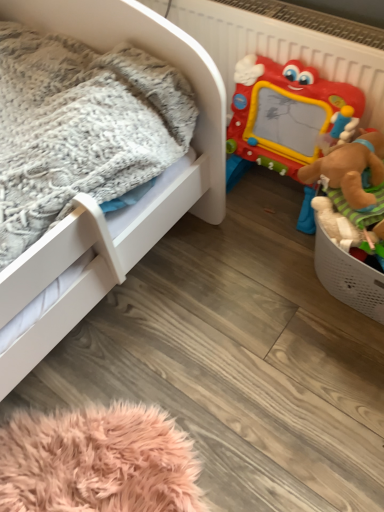
In order to click on vacant area situated below plastic drawing board at right (from a real-world perspective) in this screenshot , I will do `click(263, 204)`.